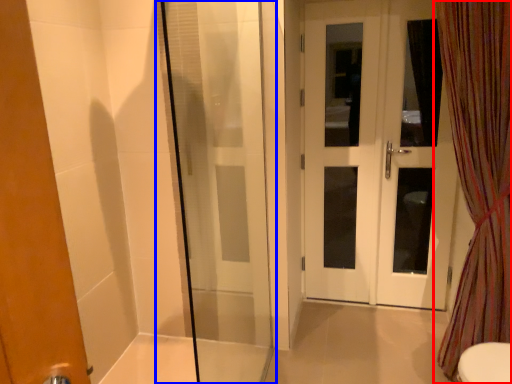
Question: Which object appears farthest to the camera in this image, curtain (highlighted by a red box) or shower door (highlighted by a blue box)?

Choices:
 (A) curtain
 (B) shower door

Answer: (A)